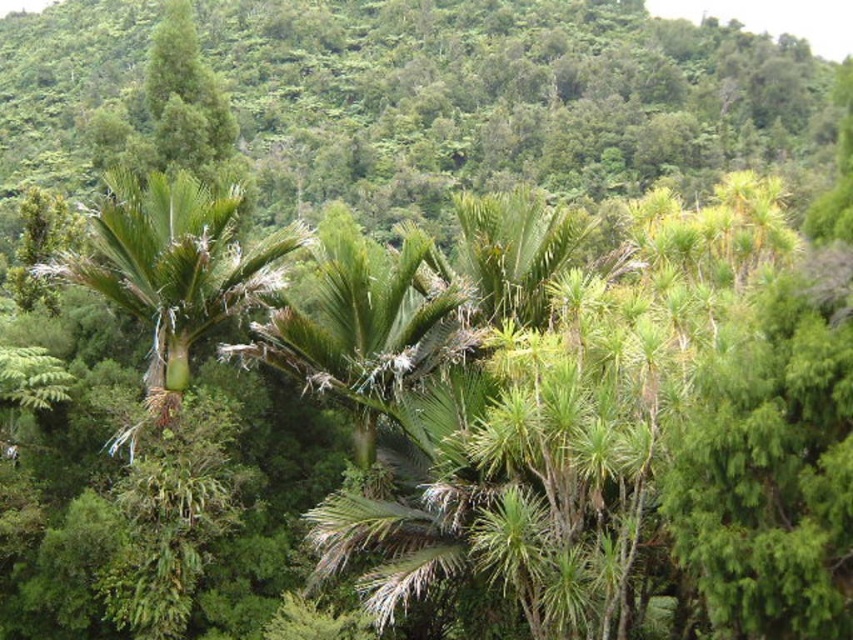
Can you confirm if green leafy palm at left is positioned above green leafy palm tree at center?

Yes, green leafy palm at left is above green leafy palm tree at center.

Identify the location of green leafy palm at left. The width and height of the screenshot is (853, 640). (172, 269).